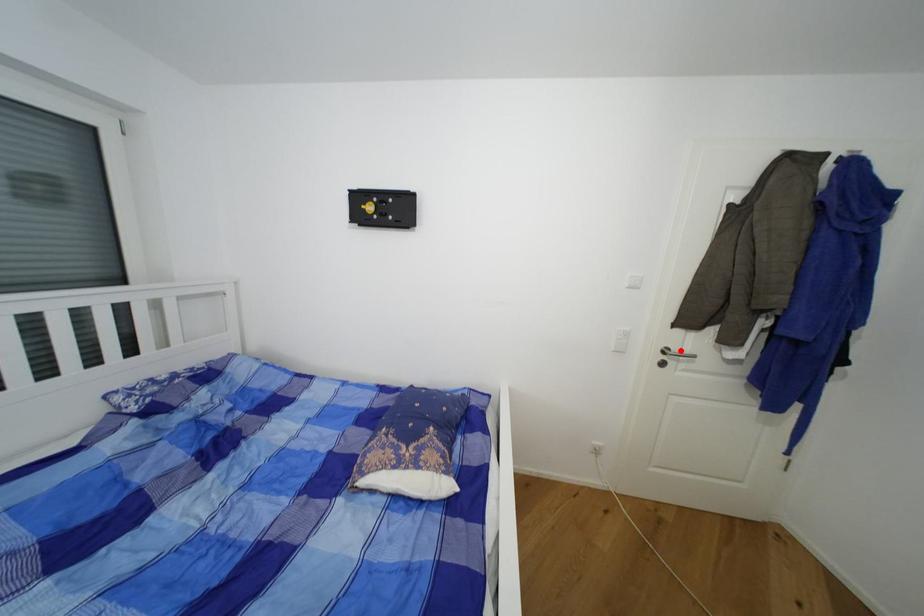
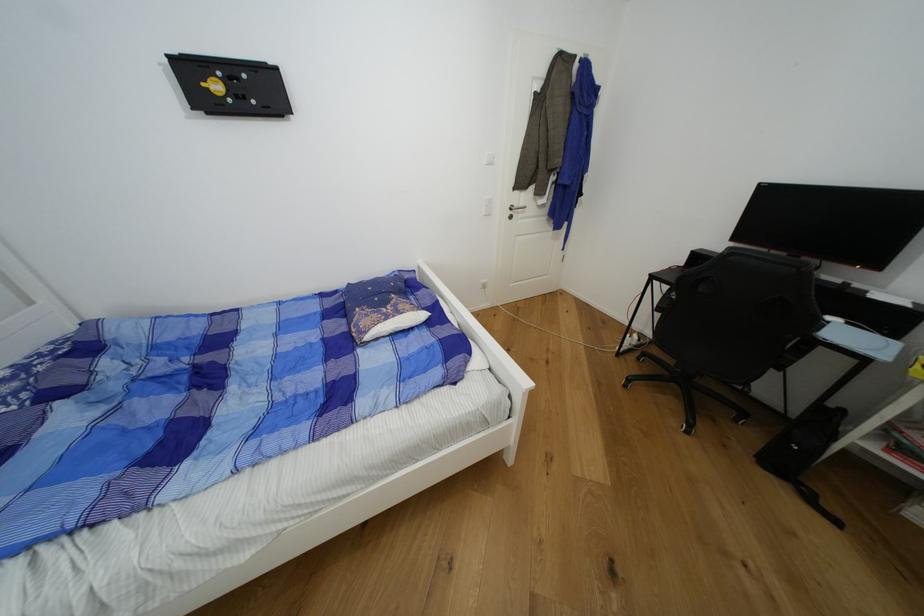
Find the pixel in the second image that matches the highlighted location in the first image.

(521, 207)